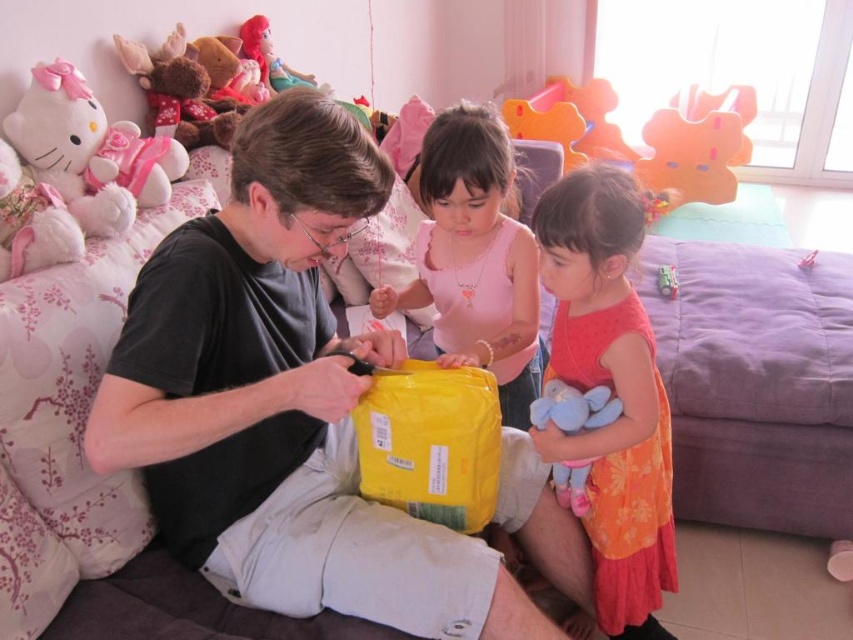
Question: Can you confirm if orange floral dress at center is positioned to the left of shiny plastic doll at upper left?

Choices:
 (A) no
 (B) yes

Answer: (A)

Question: Estimate the real-world distances between objects in this image. Which object is farther from the matte yellow plastic bag at center?

Choices:
 (A) shiny plastic doll at upper left
 (B) soft plush toy at lower right
 (C) orange floral dress at center

Answer: (A)

Question: Which object is the farthest from the shiny plastic doll at upper left?

Choices:
 (A) matte yellow plastic bag at center
 (B) black matte shirt at center
 (C) soft plush toy at lower right

Answer: (C)

Question: Which of these objects is positioned farthest from the soft plush toy at lower right?

Choices:
 (A) shiny plastic doll at upper left
 (B) matte yellow plastic bag at center
 (C) orange floral dress at center

Answer: (A)

Question: Is black matte shirt at center wider than matte plastic toy at center?

Choices:
 (A) yes
 (B) no

Answer: (A)

Question: Is black matte shirt at center smaller than shiny plastic doll at upper left?

Choices:
 (A) no
 (B) yes

Answer: (A)